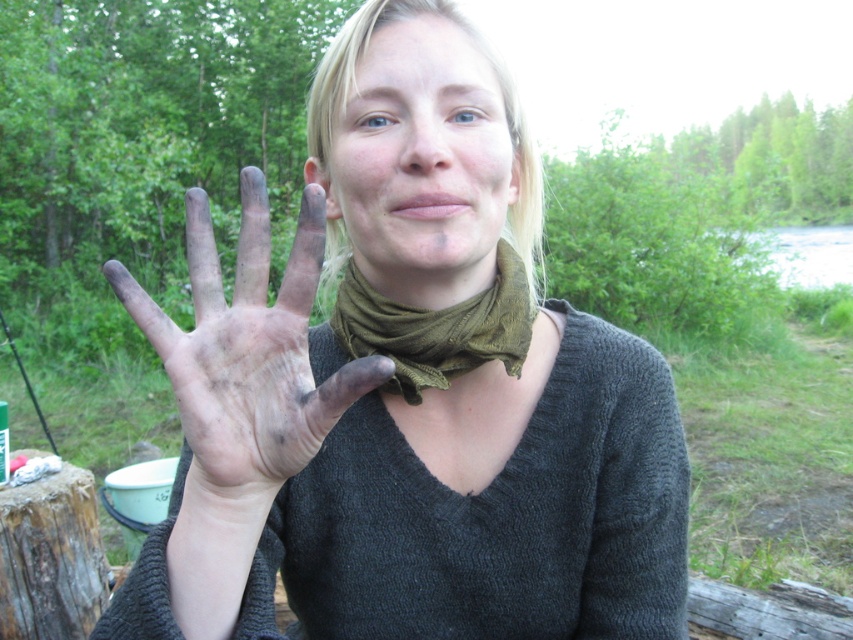
Based on the scene description, where is the point at coordinates (x=408, y=388) located?

The point at coordinates (x=408, y=388) corresponds to the dirty skin at center, which is part of the person shown in the image.

You are a photographer trying to capture the scene from the image. You want to ensure that the dirty clay hand at center and the green fabric scarf at center are both clearly visible in your shot. Based on their positions, which object should you focus on first to ensure both are in focus?

The dirty clay hand at center is positioned under the green fabric scarf at center. To ensure both are in focus, you should focus on the green fabric scarf at center first since it is closer to the camera, and the hand beneath it will also be within the depth of field.

You are standing in the forest and see two points in the distance. The first point is at coordinates point (202, 314) and the second is at point (264, 390). Which point is closer to you?

Point (202, 314) is in front of point (264, 390), so it is closer to you.